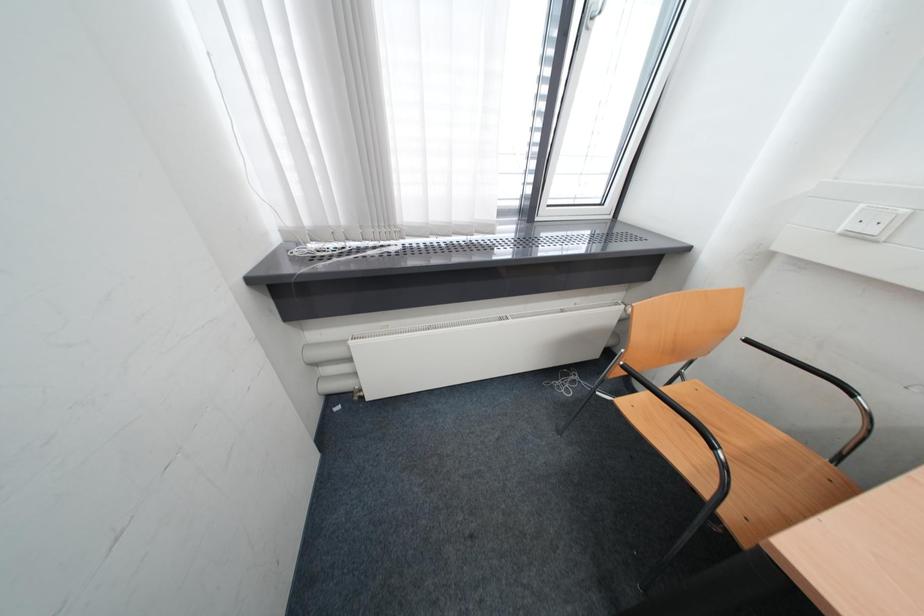
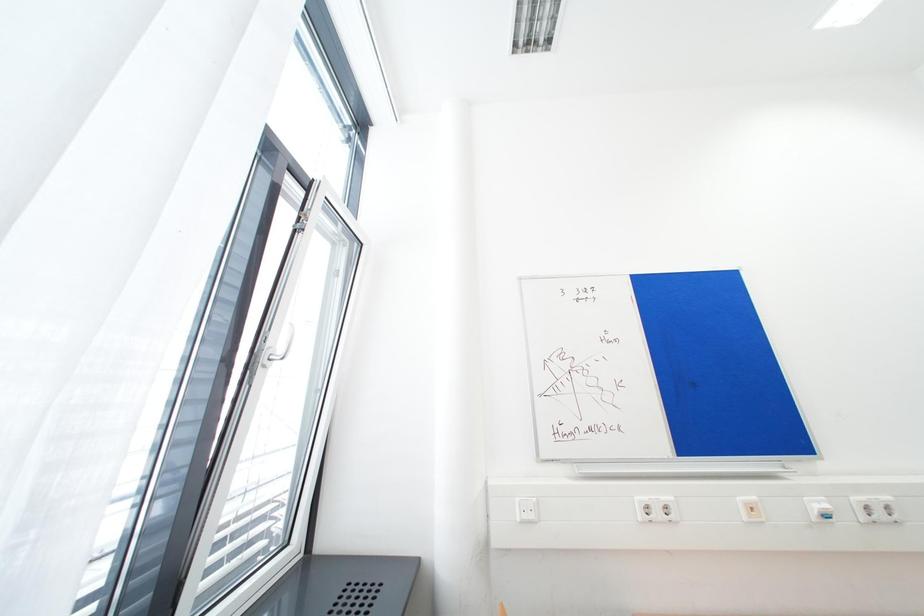
How did the camera likely rotate?

The camera rotated toward right-up.